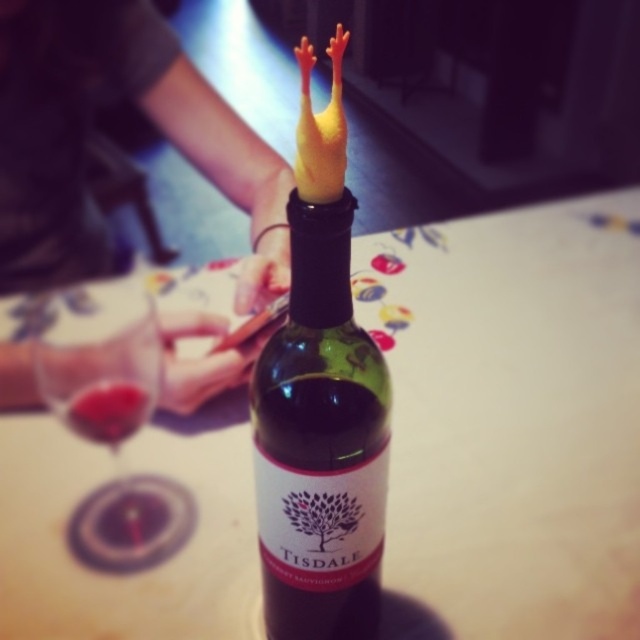
You are standing in front of the table and want to place a small object exactly at the center of the white glossy table at center. According to the coordinates provided, where should you place it?

The white glossy table at center is located at point coordinates (509, 419), so you should place the object at those coordinates to center it.